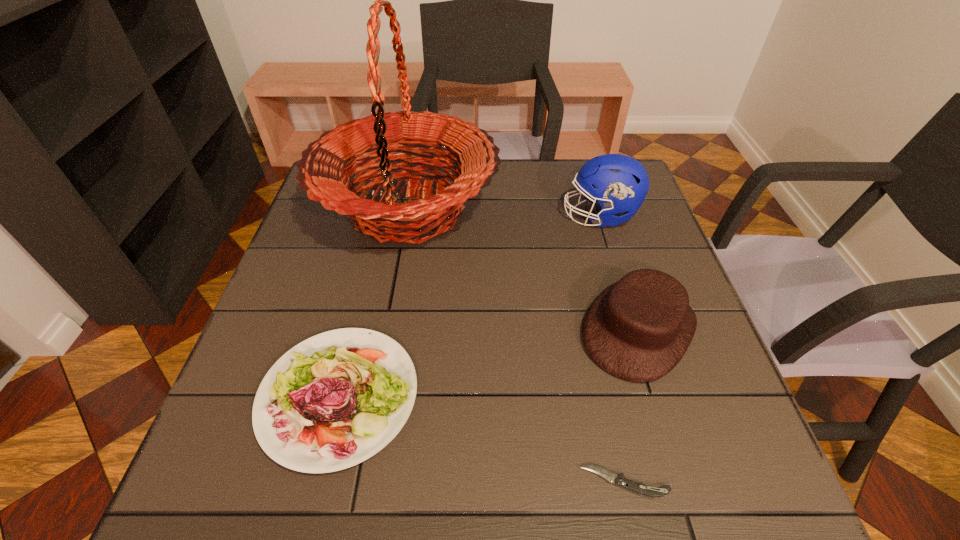
Find the location of `free space located 0.400m on the back of the salad plate`. free space located 0.400m on the back of the salad plate is located at coordinates (383, 215).

You are a GUI agent. You are given a task and a screenshot of the screen. Output one action in this format:
    pyautogui.click(x=<x>, y=<y>)
    Task: Click on the vacant space situated 0.400m on the back of the shortest object
    
    Given the screenshot: What is the action you would take?
    pyautogui.click(x=582, y=288)

Find the location of a particular element. The image size is (960, 540). basket located in the far edge section of the desktop is located at coordinates (322, 173).

At what (x,y) coordinates should I click in order to perform the action: click on football helmet at the far edge. Please return your answer as a coordinate pair (x, y). Image resolution: width=960 pixels, height=540 pixels. Looking at the image, I should click on (619, 183).

Locate an element on the screen. The width and height of the screenshot is (960, 540). salad plate that is at the near edge is located at coordinates (367, 377).

Locate an element on the screen. pocketknife situated at the near edge is located at coordinates (619, 480).

Where is `basket located at the left edge`? basket located at the left edge is located at coordinates (322, 173).

Where is `salad plate that is at the left edge`? The height and width of the screenshot is (540, 960). salad plate that is at the left edge is located at coordinates (367, 377).

Locate an element on the screen. This screenshot has height=540, width=960. football helmet present at the right edge is located at coordinates (619, 183).

Where is `hat present at the right edge`? The height and width of the screenshot is (540, 960). hat present at the right edge is located at coordinates (638, 329).